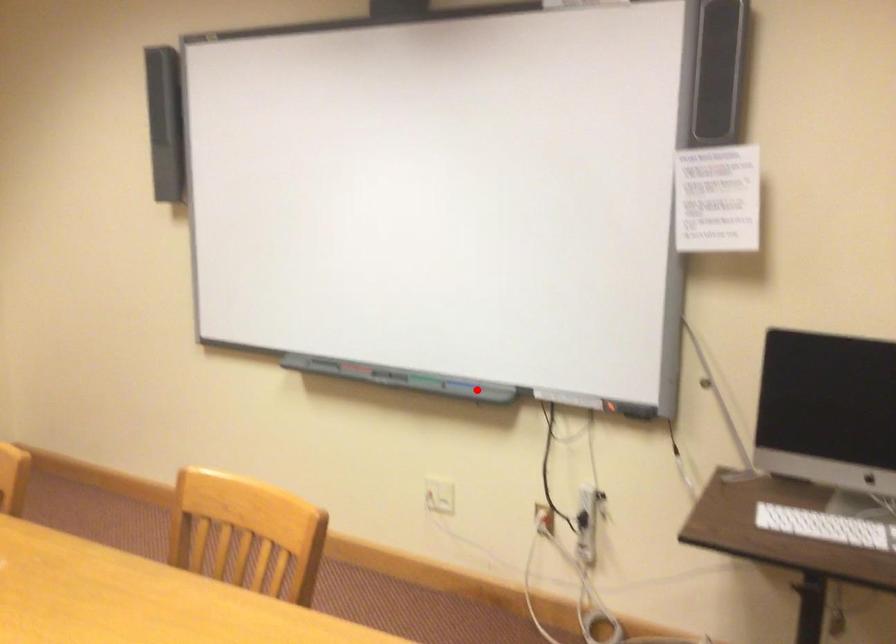
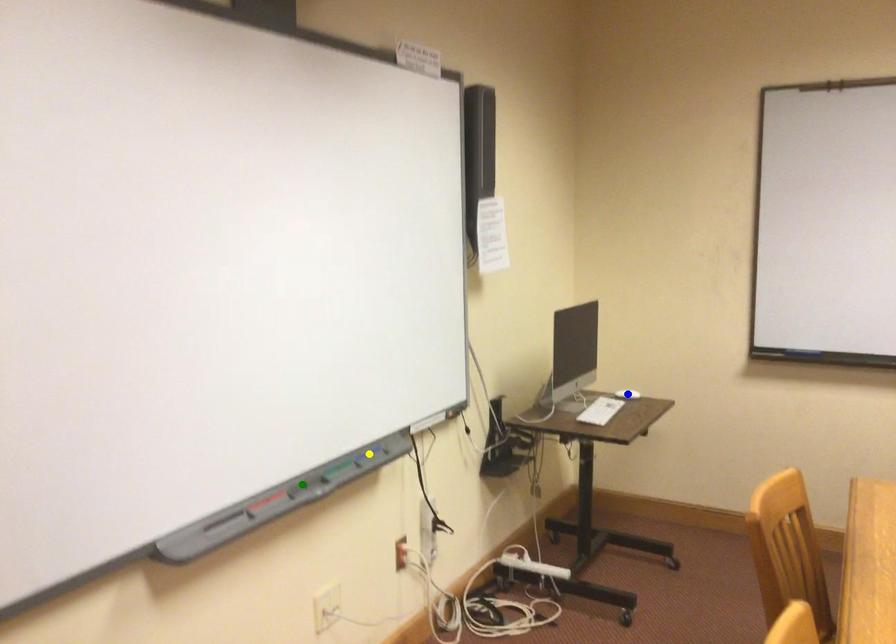
Question: I am providing you with two images of the same scene from different viewpoints. A red point is marked on the first image. You are given multiple points on the second image. Which point in image 2 is actually the same real-world point as the red point in image 1?

Choices:
 (A) blue point
 (B) green point
 (C) yellow point

Answer: (C)